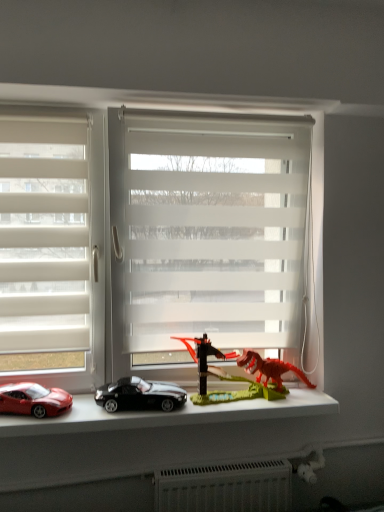
Where is `free space above metallic white window sill at lower center (from a real-world perspective)`? The image size is (384, 512). free space above metallic white window sill at lower center (from a real-world perspective) is located at coordinates (162, 402).